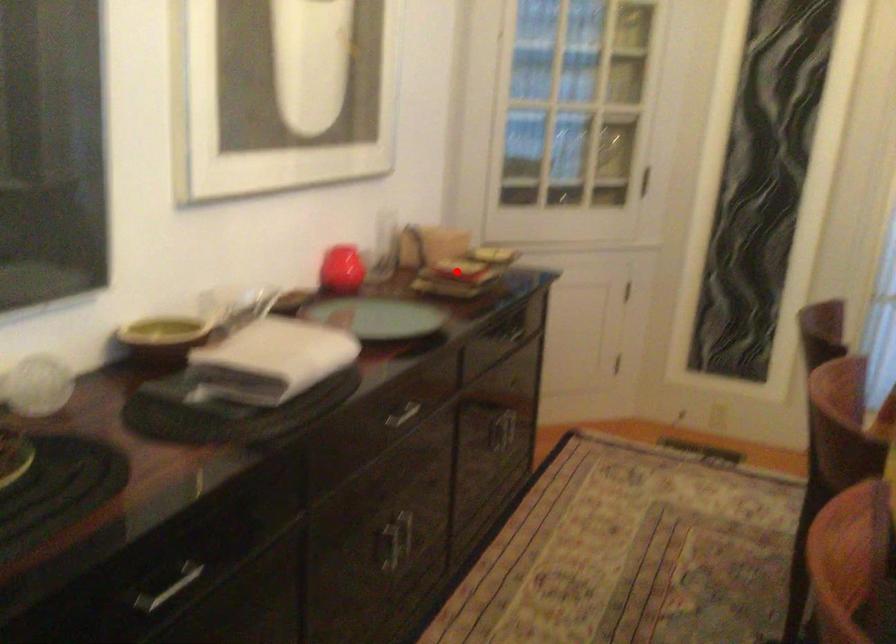
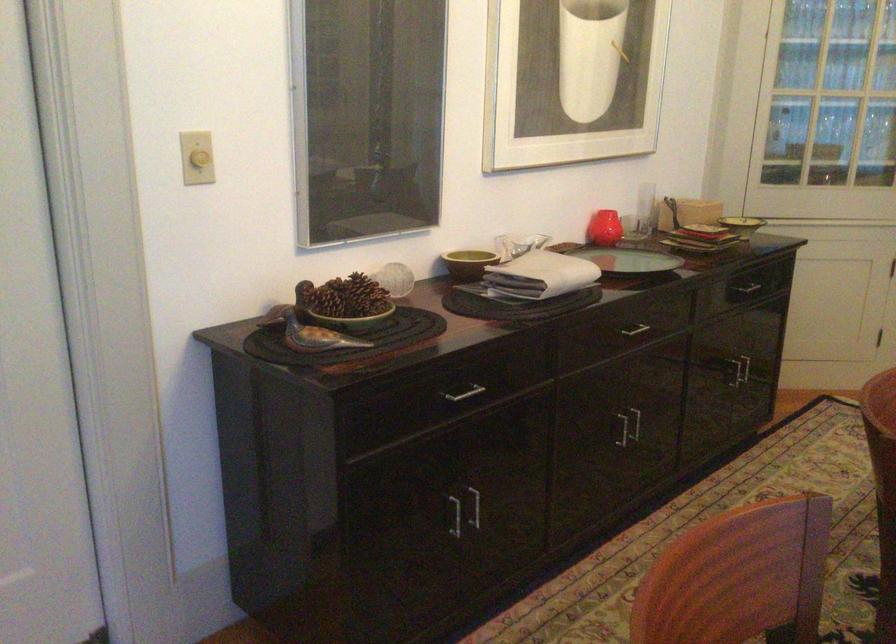
Question: I am providing you with two images of the same scene from different viewpoints. Image1 has a red point marked. In image2, the corresponding 3D location appears at what relative position? Reply with the corresponding letter.

Choices:
 (A) Closer
 (B) Farther

Answer: (B)